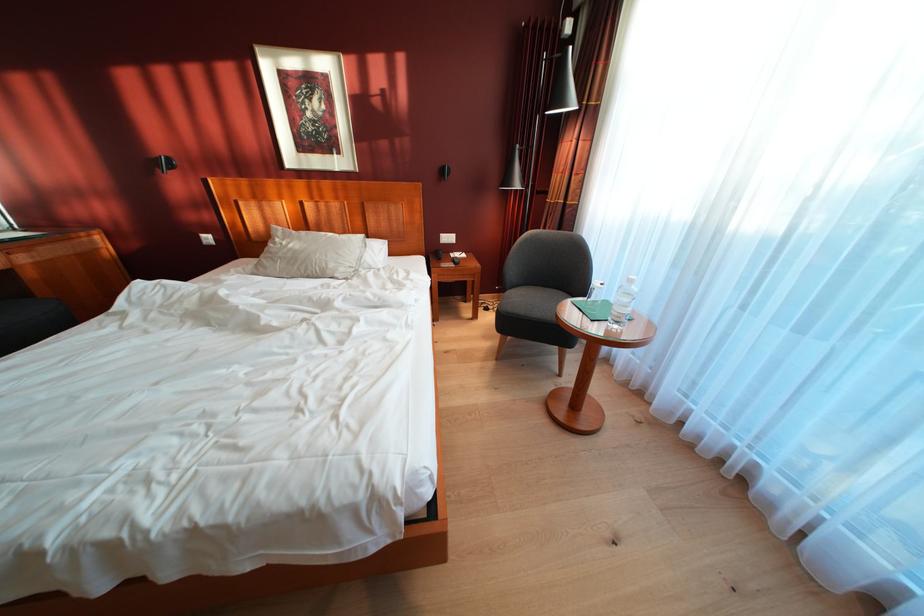
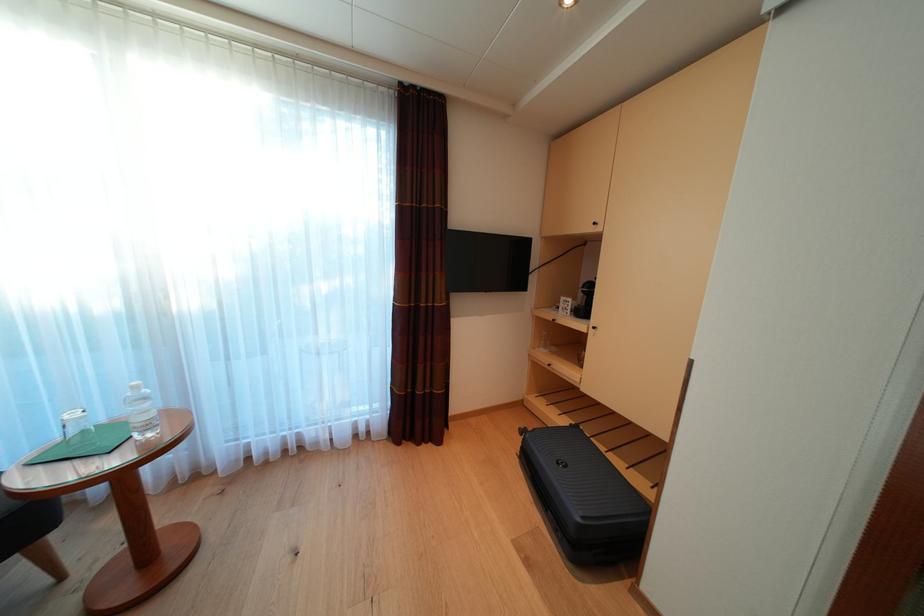
How did the camera likely rotate?

The rotation direction of the camera is right-down.